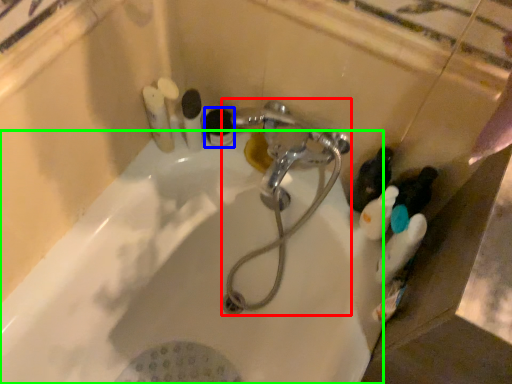
Question: Which is farther away from plumbing fixture (highlighted by a red box)? toiletry (highlighted by a blue box) or bath (highlighted by a green box)?

Choices:
 (A) toiletry
 (B) bath

Answer: (A)